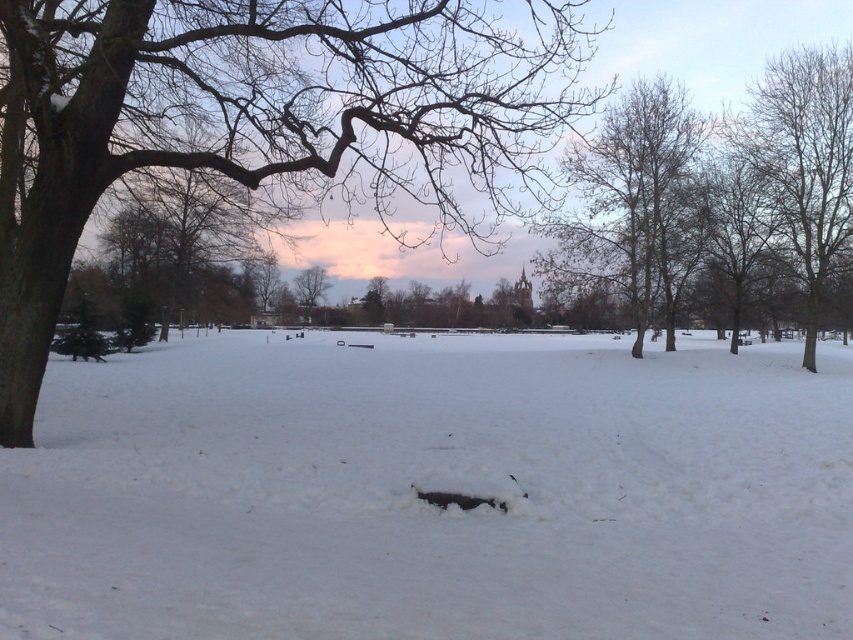
Question: Where is white fluffy snow at center located in relation to bare branches at center in the image?

Choices:
 (A) right
 (B) left

Answer: (B)

Question: Which of the following is the farthest from the observer?

Choices:
 (A) bare branches at right
 (B) smooth bark tree at left

Answer: (A)

Question: Which object is the farthest from the bare branches at center?

Choices:
 (A) smooth bark tree at left
 (B) white fluffy snow at center
 (C) bare branches at right

Answer: (B)

Question: Can you confirm if white fluffy snow at center is positioned to the left of smooth bark tree at left?

Choices:
 (A) yes
 (B) no

Answer: (B)

Question: Does bare branches at center appear over bare branches at right?

Choices:
 (A) yes
 (B) no

Answer: (B)

Question: Which object is closer to the camera taking this photo?

Choices:
 (A) white fluffy snow at center
 (B) bare branches at center
 (C) bare branches at right
 (D) smooth bark tree at left

Answer: (A)